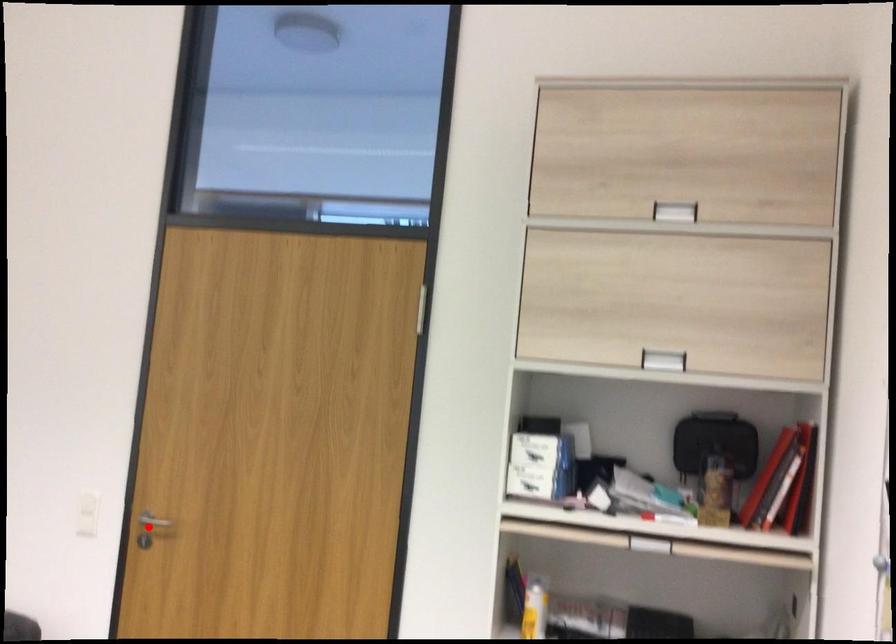
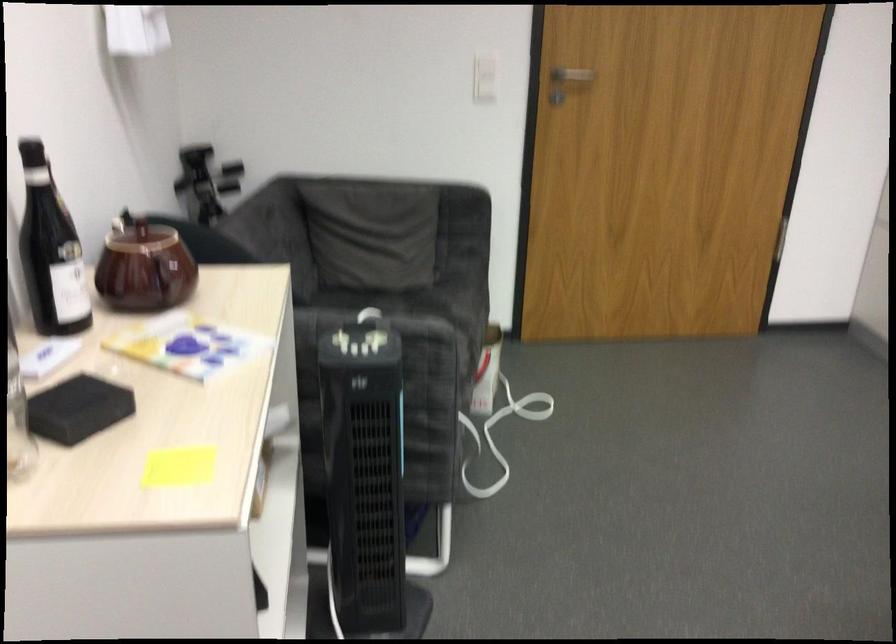
Locate, in the second image, the point that corresponds to the highlighted location in the first image.

(569, 77)